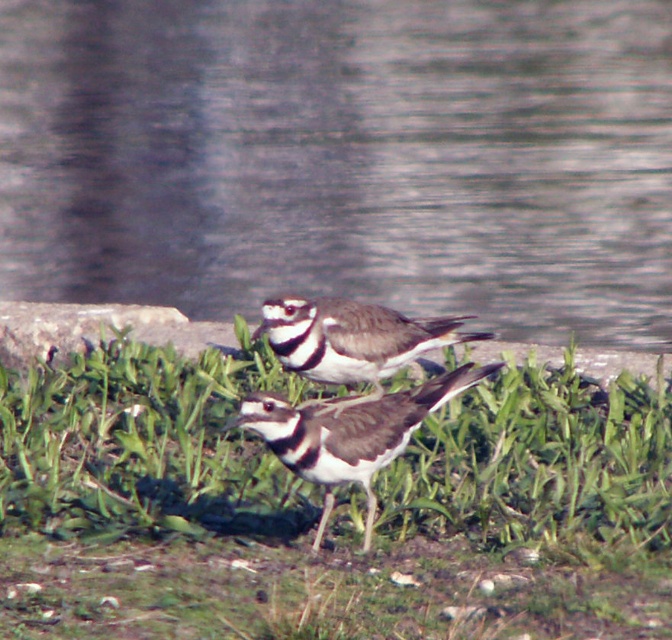
You are a photographer aiming to capture the black and white speckled bird at center without the green grass at center appearing in the foreground. Based on the scene, is this possible?

The green grass at center is above the black and white speckled bird at center, so the grass would be in the foreground, making it impossible to avoid capturing it in the photo.

You are a birdwatcher trying to identify two birds in the image. Both are described as speckled. The first is labeled as black and white speckled bird at center, and the second as speckled feathered bird at center. Based on their positions, which bird is closer to the ground?

The black and white speckled bird at center is closer to the ground because it is positioned below the speckled feathered bird at center.

You are a photographer trying to capture both birds in focus. Based on the scene, which bird should you focus on to ensure the black and white speckled bird at center and the speckled feathered bird at center are both in sharp focus?

You should focus on the black and white speckled bird at center because it is in front of the speckled feathered bird at center. By focusing on the closer bird, the depth of field may extend sufficiently to keep both birds in focus.